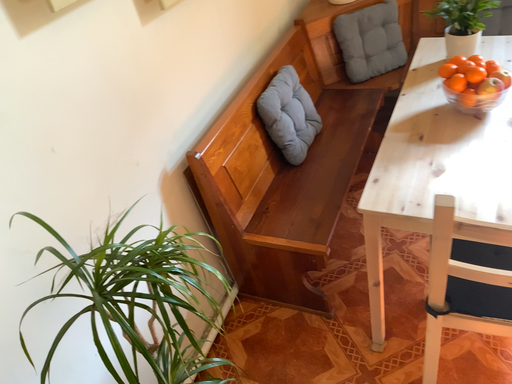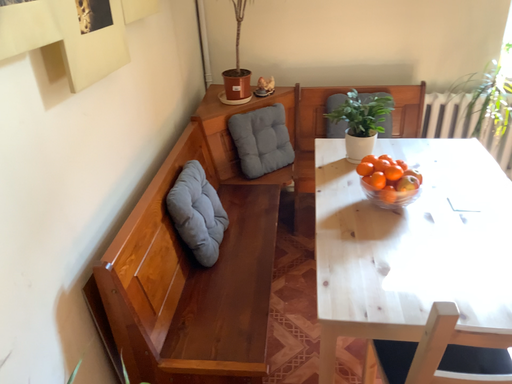
Question: How did the camera likely rotate when shooting the video?

Choices:
 (A) rotated right
 (B) rotated left

Answer: (A)